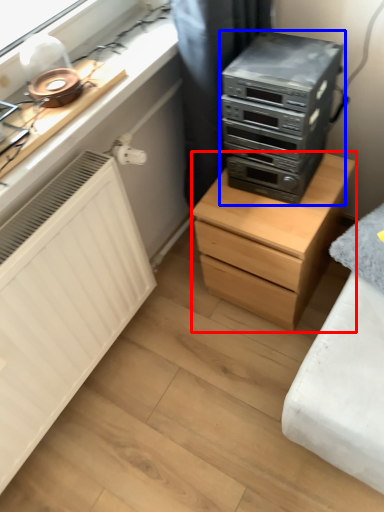
Question: Which object appears closest to the camera in this image, chest of drawers (highlighted by a red box) or home appliance (highlighted by a blue box)?

Choices:
 (A) chest of drawers
 (B) home appliance

Answer: (B)